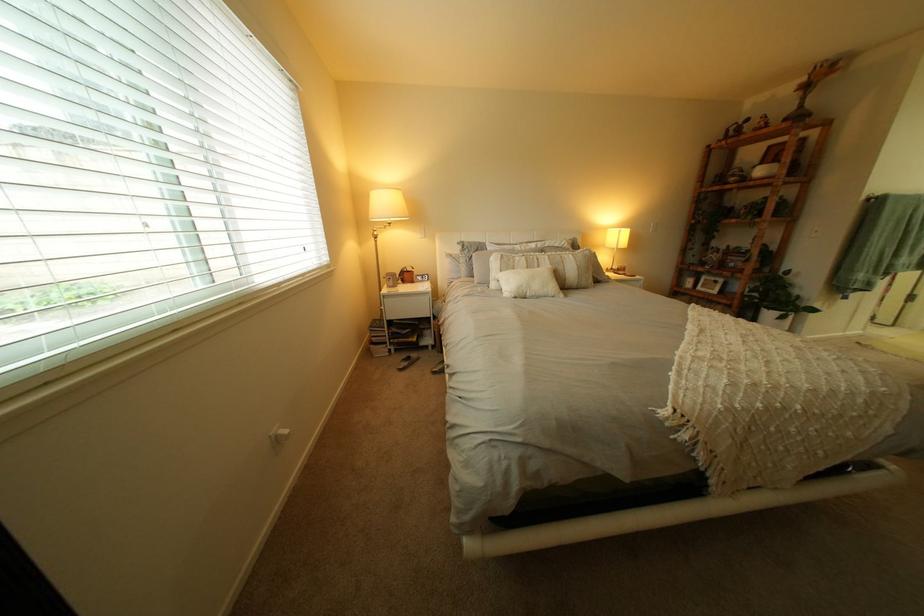
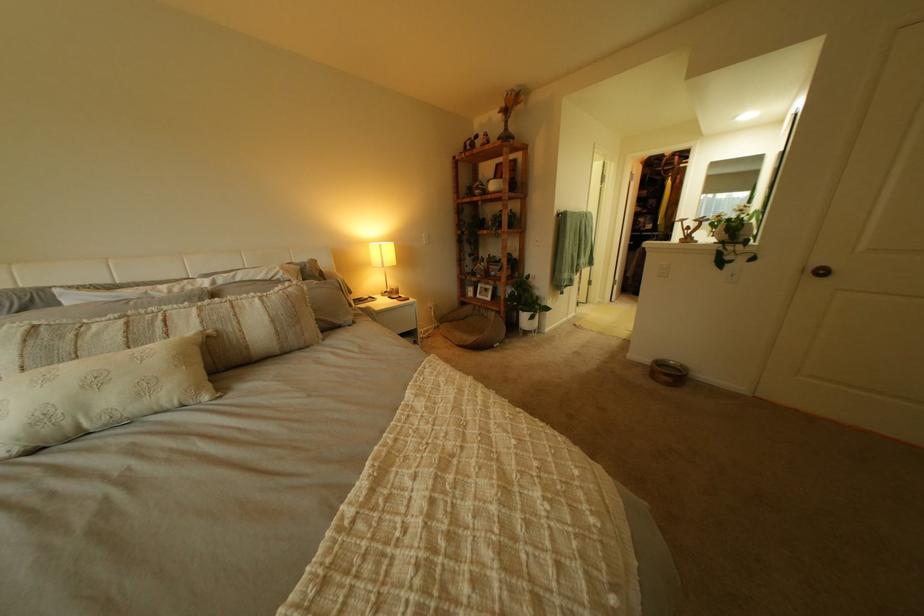
Where in the second image is the point corresponding to (748,308) from the first image?

(517, 314)